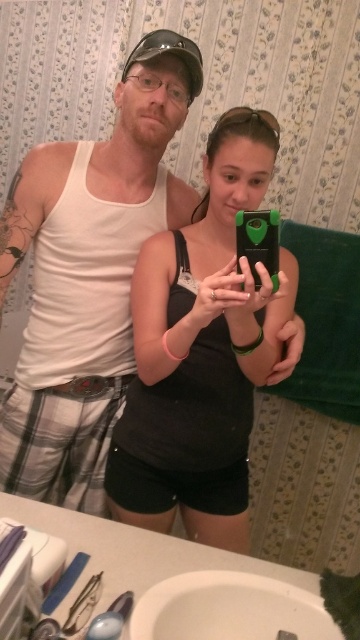
You are standing at point (x=111, y=470) and want to take a selfie with both people in the frame. How far apart should they stand from each other to ensure both are fully visible?

The two individuals are 4.35 feet apart, so to ensure both are fully visible in the selfie, they should maintain that distance of 4.35 feet apart.

You are a photographer trying to capture a closeup of the white matte tank top at upper left and the white ceramic sink at lower center in the bathroom scene. Given that your camera has a maximum focus range of 60 centimeters, will you be able to photograph both objects clearly in the same shot without moving the camera?

The white matte tank top at upper left and white ceramic sink at lower center are 66.98 centimeters apart. Since the distance between them exceeds the camera maximum focus range of 60 centimeters, you won not be able to photograph both objects clearly in the same shot without moving the camera.

Based on the scene described, which of the two tank tops, the white matte tank top at upper left or the matte black tank top at center, is larger in size?

The matte black tank top at center is larger than the white matte tank top at upper left.